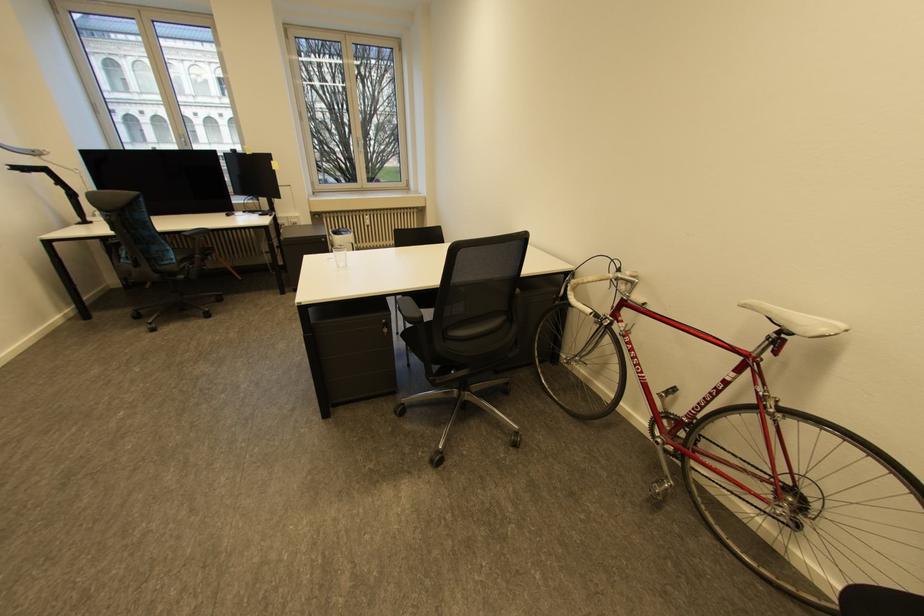
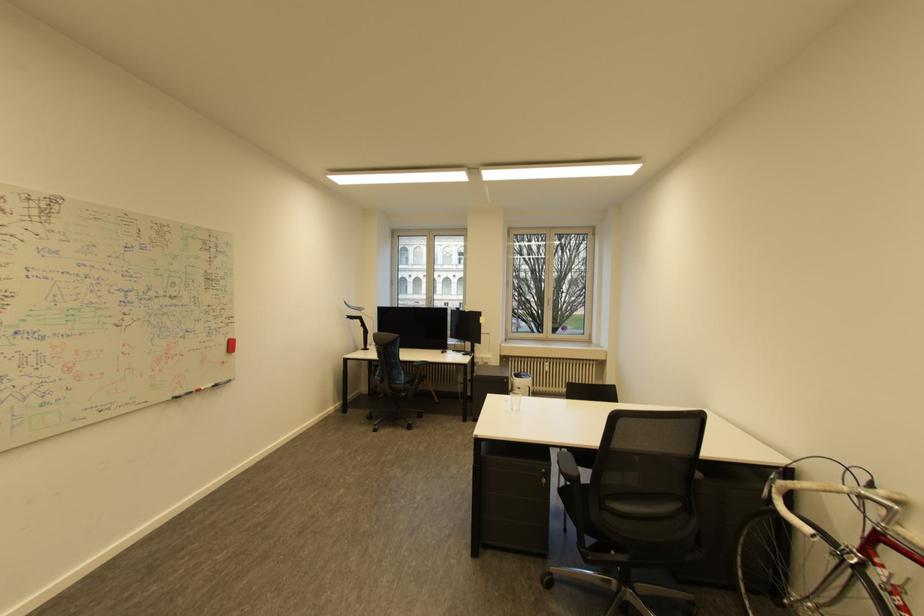
The point at (388, 331) is marked in the first image. Where is the corresponding point in the second image?

(548, 480)